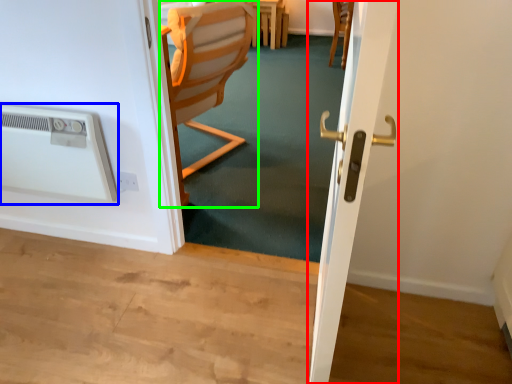
Question: Estimate the real-world distances between objects in this image. Which object is farther from screen door (highlighted by a red box), air conditioning (highlighted by a blue box) or chair (highlighted by a green box)?

Choices:
 (A) air conditioning
 (B) chair

Answer: (A)